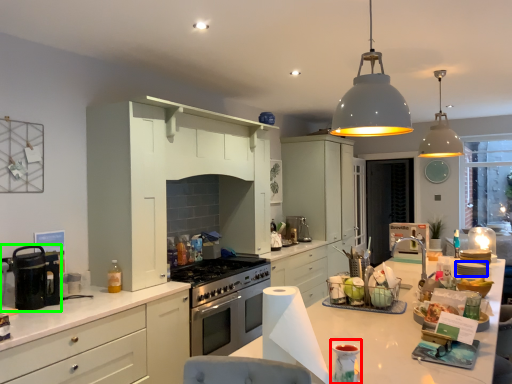
Question: Which is farther away from appliance (highlighted by a red box)? appliance (highlighted by a blue box) or kitchen appliance (highlighted by a green box)?

Choices:
 (A) appliance
 (B) kitchen appliance

Answer: (A)